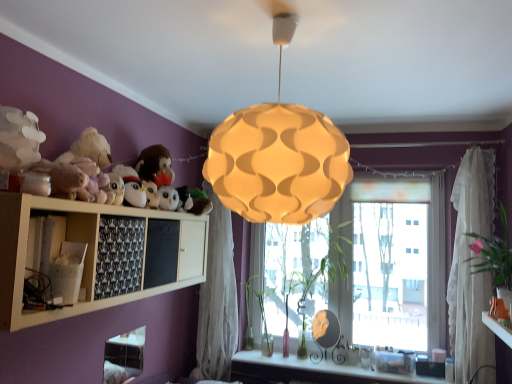
Question: Would you say white sheer curtain at center, the 2th curtain in the right-to-left sequence, contains green matte plant at center, the 3th plant when ordered from back to front?

Choices:
 (A) yes
 (B) no

Answer: (B)

Question: Can you confirm if white sheer curtain at center, the 1th curtain from the back, is wider than green matte plant at center, which appears as the 2th plant when viewed from the right?

Choices:
 (A) no
 (B) yes

Answer: (A)

Question: Is white sheer curtain at center, the 1th curtain from the back, bigger than green matte plant at center, the 3th plant when ordered from back to front?

Choices:
 (A) yes
 (B) no

Answer: (A)

Question: Does white sheer curtain at center, the 2th curtain in the right-to-left sequence, have a lesser width compared to green matte plant at center, the 3th plant when ordered from back to front?

Choices:
 (A) no
 (B) yes

Answer: (B)

Question: Is white sheer curtain at center, the 2th curtain in the right-to-left sequence, to the right of green matte plant at center, which appears as the 2th plant when viewed from the right, from the viewer's perspective?

Choices:
 (A) yes
 (B) no

Answer: (B)

Question: Relative to white lace curtain at right, placed as the 2th curtain when sorted from back to front, is white sheer curtain at center, arranged as the 2th curtain when viewed from the front, in front or behind?

Choices:
 (A) front
 (B) behind

Answer: (B)

Question: Based on their sizes in the image, would you say white sheer curtain at center, arranged as the 2th curtain when viewed from the front, is bigger or smaller than white lace curtain at right, arranged as the first curtain when viewed from the right?

Choices:
 (A) small
 (B) big

Answer: (B)

Question: Based on their positions, is white sheer curtain at center, arranged as the first curtain when viewed from the left, located to the left or right of white lace curtain at right, arranged as the first curtain when viewed from the right?

Choices:
 (A) left
 (B) right

Answer: (A)

Question: From a real-world perspective, is white sheer curtain at center, the 2th curtain in the right-to-left sequence, above or below white lace curtain at right, arranged as the first curtain when viewed from the right?

Choices:
 (A) below
 (B) above

Answer: (A)

Question: Considering the positions of black fabric at lower left, which ranks as the 1th shelf in right-to-left order, and translucent fabric window at center in the image, is black fabric at lower left, which ranks as the 1th shelf in right-to-left order, wider or thinner than translucent fabric window at center?

Choices:
 (A) wide
 (B) thin

Answer: (B)

Question: From the image's perspective, relative to translucent fabric window at center, is black fabric at lower left, which ranks as the 1th shelf in right-to-left order, above or below?

Choices:
 (A) below
 (B) above

Answer: (B)

Question: Is point (115, 218) positioned closer to the camera than point (279, 296)?

Choices:
 (A) closer
 (B) farther

Answer: (A)

Question: Would you say black fabric at lower left, which ranks as the 1th shelf in right-to-left order, is inside or outside translucent fabric window at center?

Choices:
 (A) outside
 (B) inside

Answer: (A)

Question: In the image, is green glass vase at window, which is counted as the fourth plant, starting from the front, positioned in front of or behind white glossy vanity at lower center?

Choices:
 (A) front
 (B) behind

Answer: (B)

Question: From the image's perspective, is green glass vase at window, the 4th plant when ordered from right to left, positioned above or below white glossy vanity at lower center?

Choices:
 (A) below
 (B) above

Answer: (B)